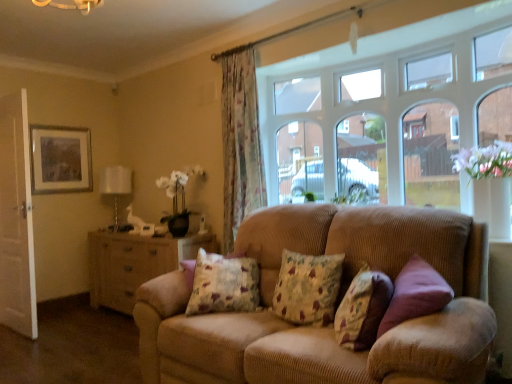
This screenshot has height=384, width=512. I want to click on free space above matte gold picture frame at upper left (from a real-world perspective), so click(59, 120).